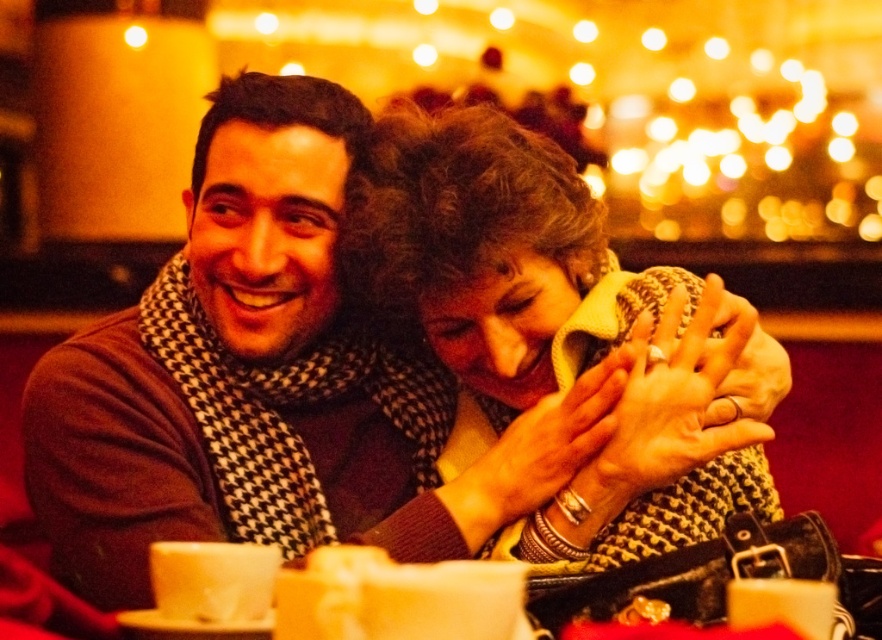
Is point (230, 340) closer to camera compared to point (435, 212)?

That is False.

Is brown wool sweater at left further to the viewer compared to knitted yellow scarf at center?

No.

Which is in front, point (218, 332) or point (618, 445)?

Point (618, 445) is in front.

Locate an element on the screen. The height and width of the screenshot is (640, 882). brown wool sweater at left is located at coordinates (238, 372).